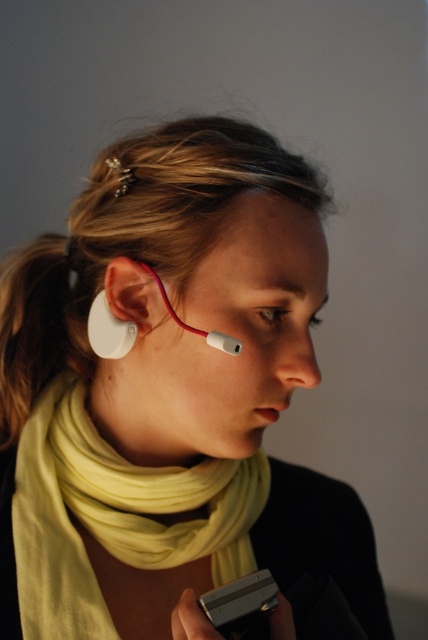
You are a delivery robot with a 15 cm wide package. You need to place it between the yellow soft scarf at lower center and the white matte earbud at lower left. Is there enough space?

The distance between the yellow soft scarf at lower center and the white matte earbud at lower left is 15.18 centimeters. Since the package is 15 cm wide, there is just enough space to place it between them.

You are a delivery robot that needs to place a small package on the skinsmoothneck at center. The package is 4 inches long. Can you fit it there without overlapping the white matte earbud at left?

The white matte earbud at left is 4.26 inches away from the skinsmoothneck at center. Since the package is 4 inches long, it can be placed there without overlapping the earbud as there is enough space between them.

You are a photographer adjusting the lighting for a portrait. You notice two points of light reflected in the subject. The first point is at coordinate point (151, 388) and the second at point (103, 348). Which point is closer to the camera?

Point (151, 388) is in front of point (103, 348), so it is closer to the camera.